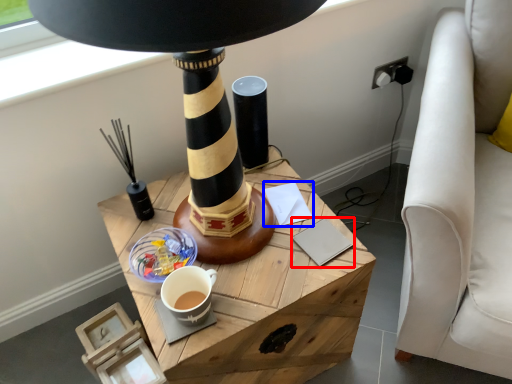
Question: Which of the following is the farthest to the observer, notepad (highlighted by a red box) or notepad (highlighted by a blue box)?

Choices:
 (A) notepad
 (B) notepad

Answer: (B)